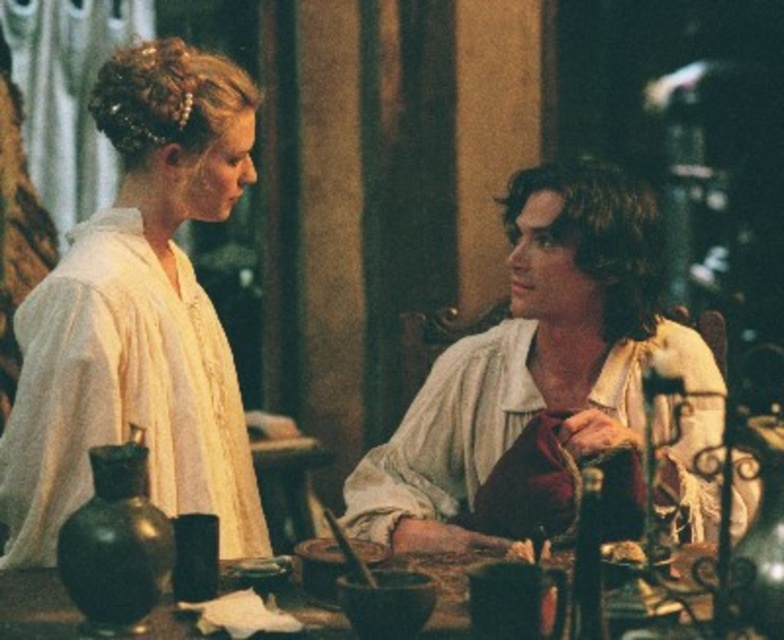
Can you confirm if matte white blouse at upper left is positioned above velvet maroon robe at right?

Correct, matte white blouse at upper left is located above velvet maroon robe at right.

Which is above, matte white blouse at upper left or velvet maroon robe at right?

Positioned higher is matte white blouse at upper left.

Is point (67, 442) more distant than point (396, 497)?

That is False.

In order to click on matte white blouse at upper left in this screenshot , I will do pyautogui.click(x=140, y=316).

Can you confirm if matte white blouse at upper left is positioned above wooden table at center?

Yes, matte white blouse at upper left is above wooden table at center.

Does matte white blouse at upper left have a lesser width compared to wooden table at center?

Indeed, matte white blouse at upper left has a lesser width compared to wooden table at center.

Which is in front, point (38, 298) or point (78, 618)?

Positioned in front is point (78, 618).

You are a GUI agent. You are given a task and a screenshot of the screen. Output one action in this format:
    pyautogui.click(x=<x>, y=<y>)
    Task: Click on the matte white blouse at upper left
    
    Given the screenshot: What is the action you would take?
    pyautogui.click(x=140, y=316)

Is point (706, 483) less distant than point (71, 621)?

No, it is behind (71, 621).

Where is `velvet maroon robe at right`? This screenshot has height=640, width=784. velvet maroon robe at right is located at coordinates (447, 435).

Is point (668, 490) closer to camera compared to point (686, 554)?

No, it is not.

Find the location of a particular element. This screenshot has height=640, width=784. velvet maroon robe at right is located at coordinates (447, 435).